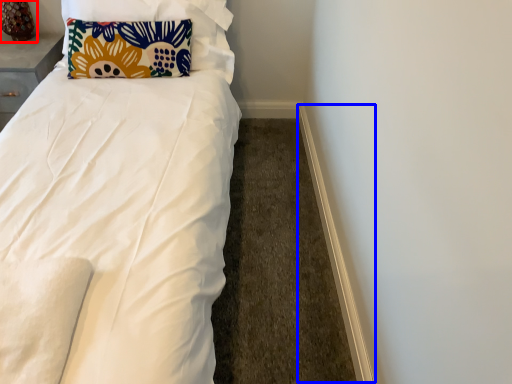
Question: Which object is further to the camera taking this photo, table lamp (highlighted by a red box) or trim (highlighted by a blue box)?

Choices:
 (A) table lamp
 (B) trim

Answer: (A)